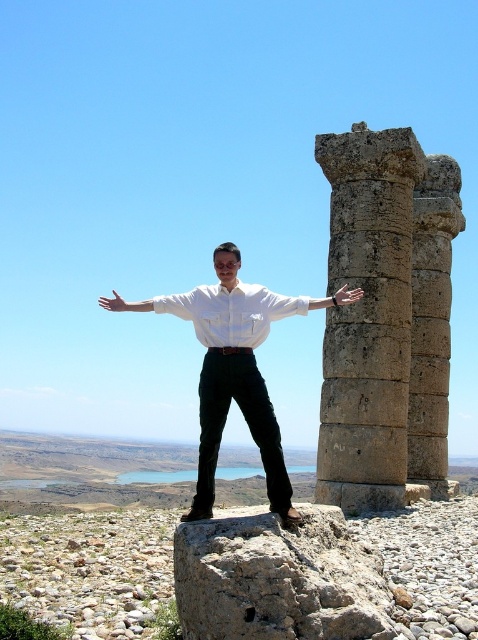
Is white matte dress shirt at center positioned in front of smooth skin hand at center?

Yes, white matte dress shirt at center is closer to the viewer.

Find the location of `white matte dress shirt at center`. white matte dress shirt at center is located at coordinates click(230, 312).

Describe the element at coordinates (230, 312) in the screenshot. The image size is (478, 640). I see `white matte dress shirt at center` at that location.

The width and height of the screenshot is (478, 640). I want to click on white matte dress shirt at center, so tap(230, 312).

Between point (328, 141) and point (281, 307), which one is positioned in front?

Point (281, 307) is more forward.

Between gray stone column at center and white matte arm at right, which one has more height?

With more height is gray stone column at center.

Is point (368, 346) closer to viewer compared to point (302, 298)?

That is False.

Locate an element on the screen. The height and width of the screenshot is (640, 478). gray stone column at center is located at coordinates (367, 317).

Is white matte arm at right positioned behind metallic silver hand at right?

No.

Describe the element at coordinates (314, 301) in the screenshot. I see `white matte arm at right` at that location.

This screenshot has width=478, height=640. What are the coordinates of `white matte arm at right` in the screenshot? It's located at (314, 301).